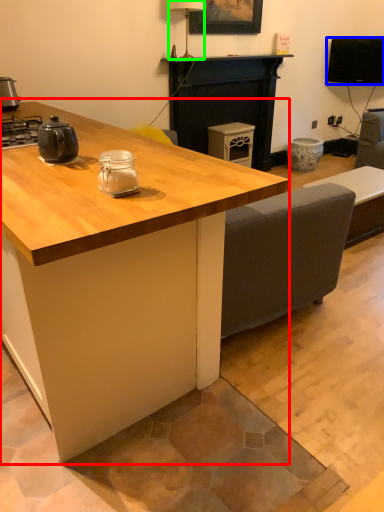
Question: Based on their relative distances, which object is nearer to table (highlighted by a red box)? Choose from television (highlighted by a blue box) and lamp (highlighted by a green box).

Choices:
 (A) television
 (B) lamp

Answer: (B)